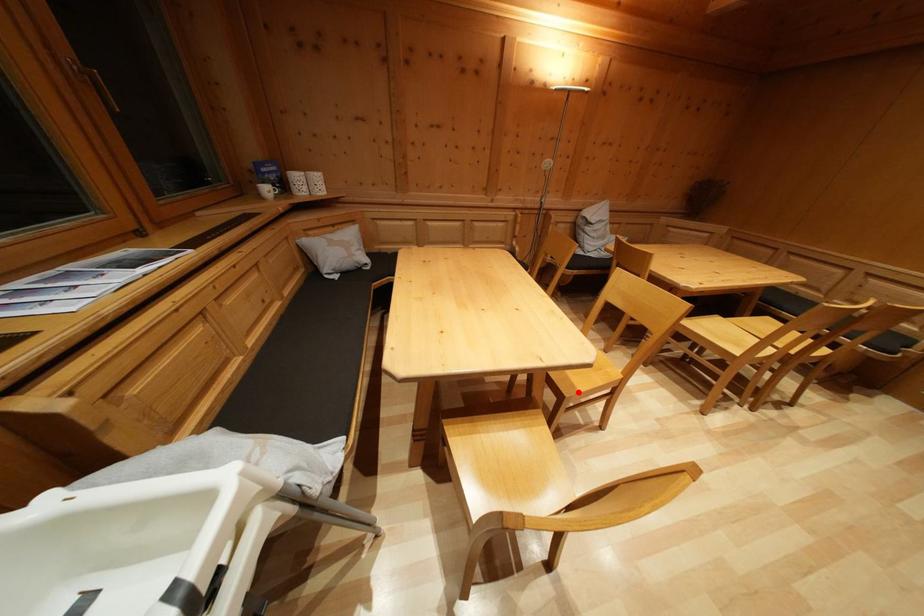
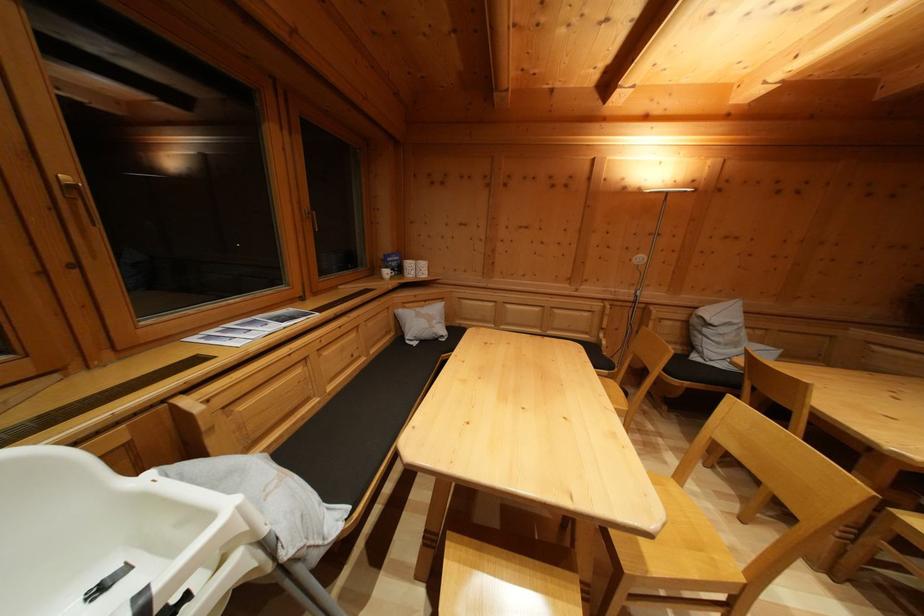
The point at the highlighted location is marked in the first image. Where is the corresponding point in the second image?

(647, 564)